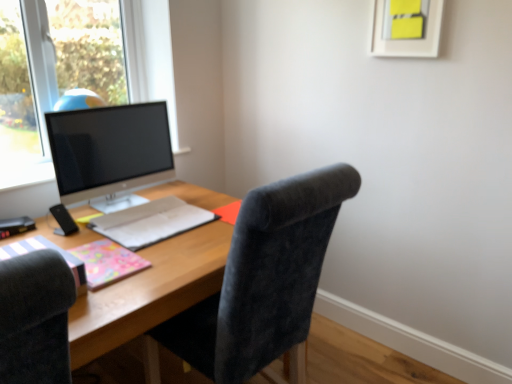
Question: Is satin black monitor at left further to camera compared to wooden desk at center?

Choices:
 (A) yes
 (B) no

Answer: (A)

Question: Can you confirm if satin black monitor at left is positioned to the right of wooden desk at center?

Choices:
 (A) no
 (B) yes

Answer: (A)

Question: Is satin black monitor at left taller than wooden desk at center?

Choices:
 (A) yes
 (B) no

Answer: (B)

Question: Is satin black monitor at left smaller than wooden desk at center?

Choices:
 (A) no
 (B) yes

Answer: (B)

Question: From a real-world perspective, is satin black monitor at left on top of wooden desk at center?

Choices:
 (A) no
 (B) yes

Answer: (B)

Question: Considering the relative positions of wooden desk at center and pink glossy notebook at lower left, positioned as the 2th notebook in back-to-front order, in the image provided, is wooden desk at center to the left or to the right of pink glossy notebook at lower left, positioned as the 2th notebook in back-to-front order,?

Choices:
 (A) right
 (B) left

Answer: (A)

Question: From the image's perspective, is wooden desk at center above or below pink glossy notebook at lower left, positioned as the 2th notebook in back-to-front order?

Choices:
 (A) below
 (B) above

Answer: (A)

Question: Is point (140, 319) positioned closer to the camera than point (108, 241)?

Choices:
 (A) farther
 (B) closer

Answer: (B)

Question: In the image, is wooden desk at center positioned in front of or behind pink glossy notebook at lower left, marked as the second notebook in a front-to-back arrangement?

Choices:
 (A) front
 (B) behind

Answer: (A)

Question: Would you say velvet dark gray chair at center is inside or outside matte gray notebook at center, which is the first notebook from back to front?

Choices:
 (A) outside
 (B) inside

Answer: (A)

Question: Looking at their shapes, would you say velvet dark gray chair at center is wider or thinner than matte gray notebook at center, which is the first notebook from back to front?

Choices:
 (A) wide
 (B) thin

Answer: (A)

Question: In the image, is velvet dark gray chair at center positioned in front of or behind matte gray notebook at center, which ranks as the third notebook in front-to-back order?

Choices:
 (A) front
 (B) behind

Answer: (A)

Question: Is velvet dark gray chair at center bigger or smaller than matte gray notebook at center, which is the first notebook from back to front?

Choices:
 (A) big
 (B) small

Answer: (A)

Question: In terms of width, does matte gray notebook at center, which is the first notebook from back to front, look wider or thinner when compared to pink glossy notebook at lower left, marked as the second notebook in a front-to-back arrangement?

Choices:
 (A) wide
 (B) thin

Answer: (A)

Question: Considering the positions of point (115, 230) and point (112, 279), is point (115, 230) closer or farther from the camera than point (112, 279)?

Choices:
 (A) farther
 (B) closer

Answer: (A)